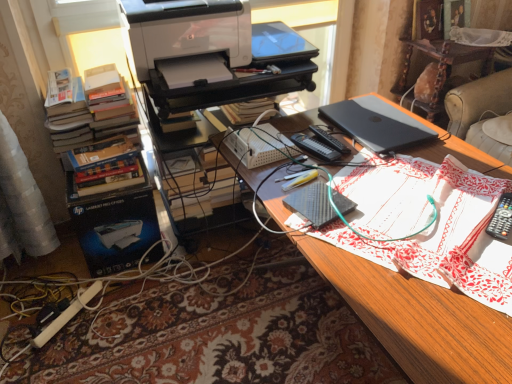
The height and width of the screenshot is (384, 512). I want to click on free space in front of black matte laptop at upper right, so click(402, 172).